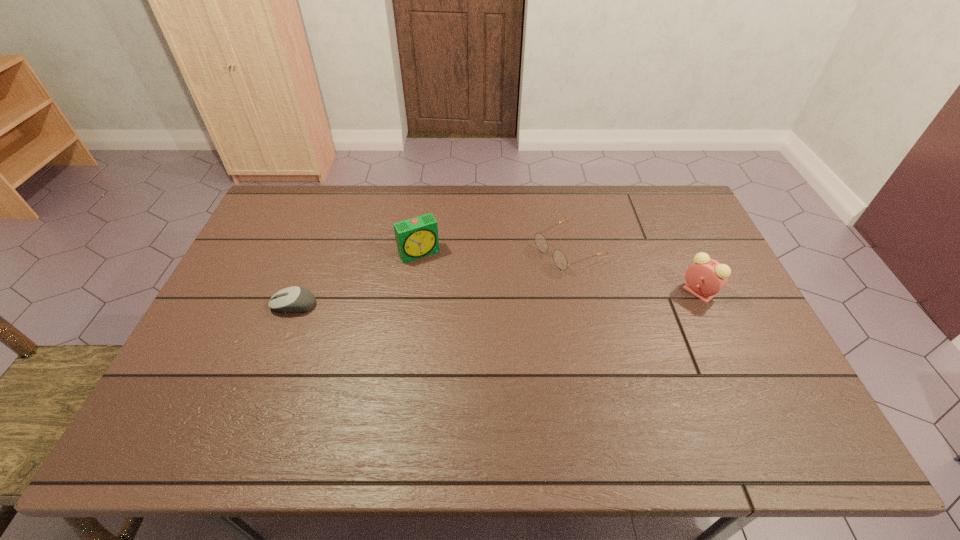
The height and width of the screenshot is (540, 960). In the image, there is a desktop. In order to click on vacant space at the near edge in this screenshot , I will do `click(449, 374)`.

In the image, there is a desktop. Where is `free region at the left edge`? The height and width of the screenshot is (540, 960). free region at the left edge is located at coordinates (260, 273).

Identify the location of vacant region at the right edge of the desktop. The height and width of the screenshot is (540, 960). (721, 345).

Locate an element on the screen. Image resolution: width=960 pixels, height=540 pixels. free space at the far left corner of the desktop is located at coordinates (305, 216).

The height and width of the screenshot is (540, 960). What are the coordinates of `vacant space at the far right corner of the desktop` in the screenshot? It's located at (639, 197).

Identify the location of free space between the left alarm clock and the third object from left to right. The height and width of the screenshot is (540, 960). (494, 251).

Where is `blank region between the computer equipment and the rightmost object`? This screenshot has width=960, height=540. blank region between the computer equipment and the rightmost object is located at coordinates (496, 299).

You are a GUI agent. You are given a task and a screenshot of the screen. Output one action in this format:
    pyautogui.click(x=<x>, y=<y>)
    Task: Click on the free space between the rightmost object and the third object from right to left
    The width and height of the screenshot is (960, 540).
    Given the screenshot: What is the action you would take?
    pyautogui.click(x=559, y=272)

Locate an element on the screen. The width and height of the screenshot is (960, 540). free space between the left alarm clock and the spectacles is located at coordinates (494, 251).

Locate an element on the screen. free spot between the right alarm clock and the computer equipment is located at coordinates (496, 299).